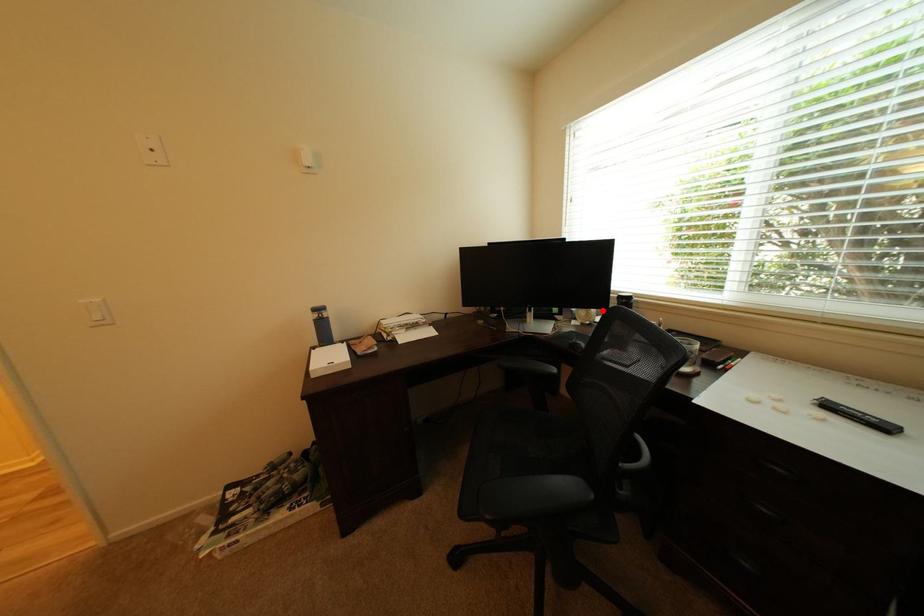
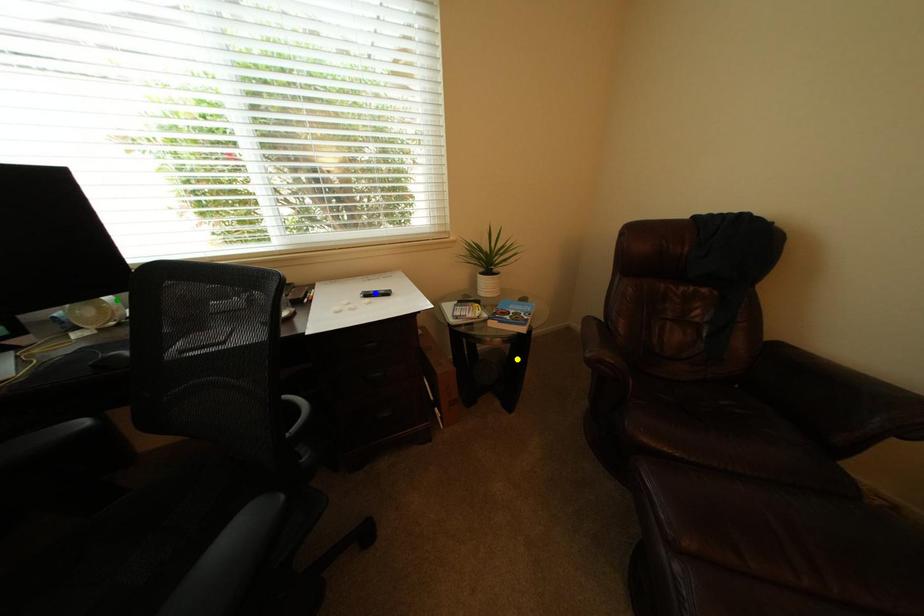
Question: I am providing you with two images of the same scene from different viewpoints. A red point is marked on the first image. You are given multiple points on the second image. Which spot in image 2 lines up with the point in image 1?

Choices:
 (A) yellow point
 (B) blue point
 (C) green point

Answer: (C)